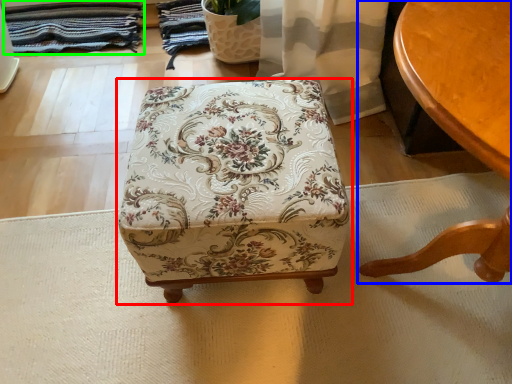
Question: Considering the real-world distances, which object is farthest from furniture (highlighted by a red box)? table (highlighted by a blue box) or blanket (highlighted by a green box)?

Choices:
 (A) table
 (B) blanket

Answer: (B)